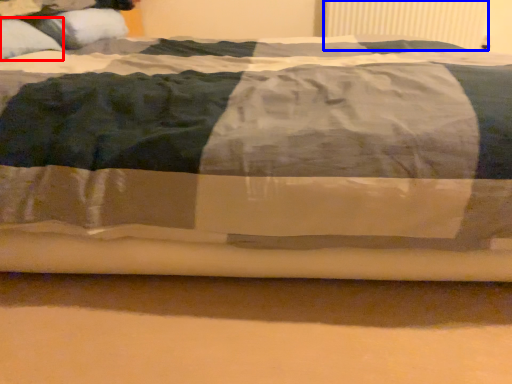
Question: Which object appears closest to the camera in this image, pillow (highlighted by a red box) or radiator (highlighted by a blue box)?

Choices:
 (A) pillow
 (B) radiator

Answer: (A)